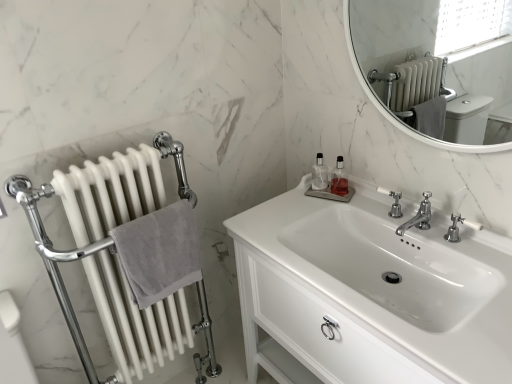
Identify the location of space that is in front of clear glass bottle at upper center, marked as the first toiletry in a left-to-right arrangement. (308, 208).